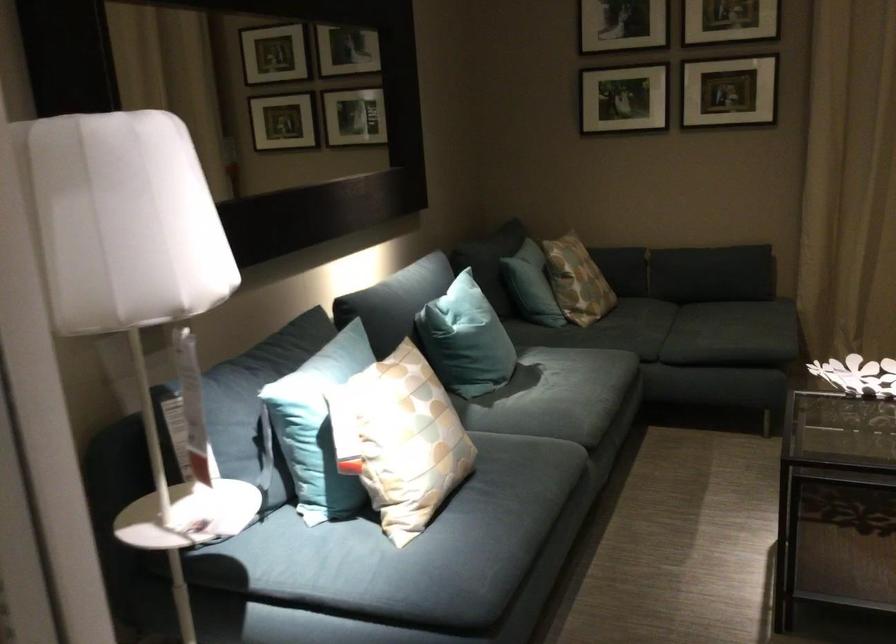
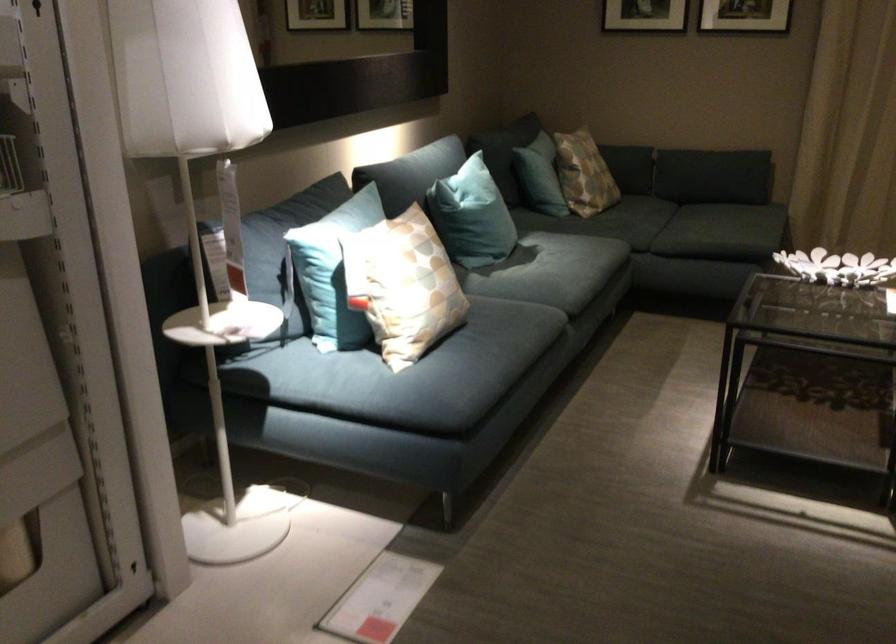
Locate, in the second image, the point that corresponds to (x=574, y=283) in the first image.

(583, 174)